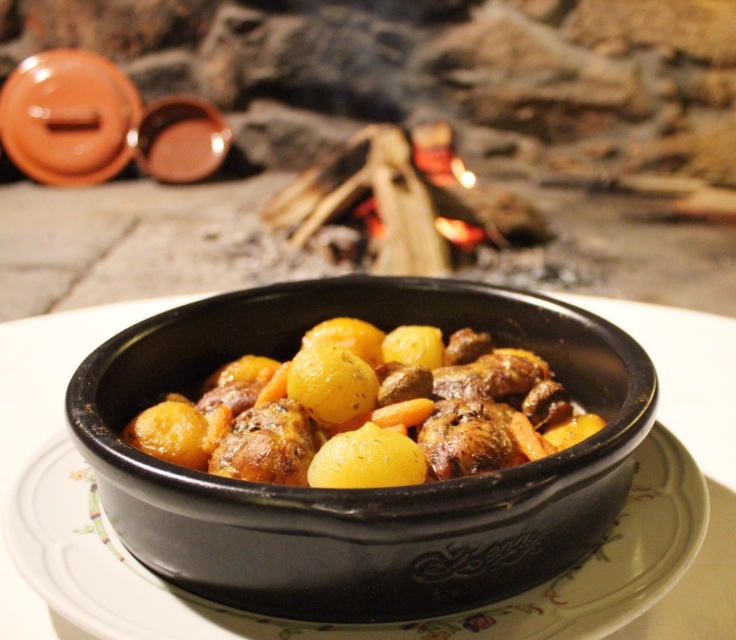
Question: Does black ceramic bowl at center appear on the left side of golden brown glazed meat and vegetables at center?

Choices:
 (A) no
 (B) yes

Answer: (B)

Question: Which object appears farthest from the camera in this image?

Choices:
 (A) black ceramic bowl at center
 (B) golden brown glazed meat and vegetables at center

Answer: (B)

Question: Observing the image, what is the correct spatial positioning of black ceramic bowl at center in reference to golden brown glazed meat and vegetables at center?

Choices:
 (A) left
 (B) right

Answer: (A)

Question: Does black ceramic bowl at center have a lesser width compared to golden brown glazed meat and vegetables at center?

Choices:
 (A) yes
 (B) no

Answer: (B)